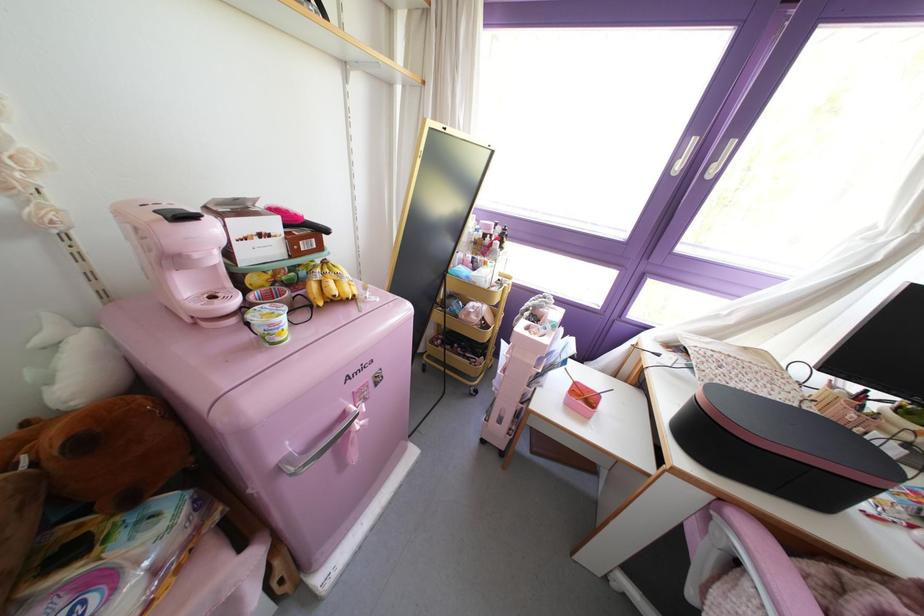
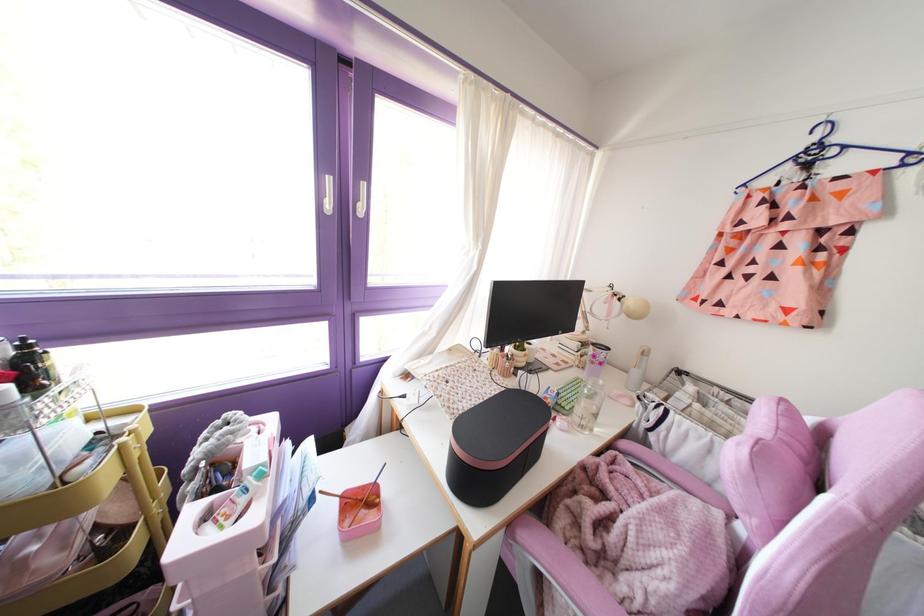
Where in the second image is the point corresponding to point 594,392 from the first image?

(370, 484)